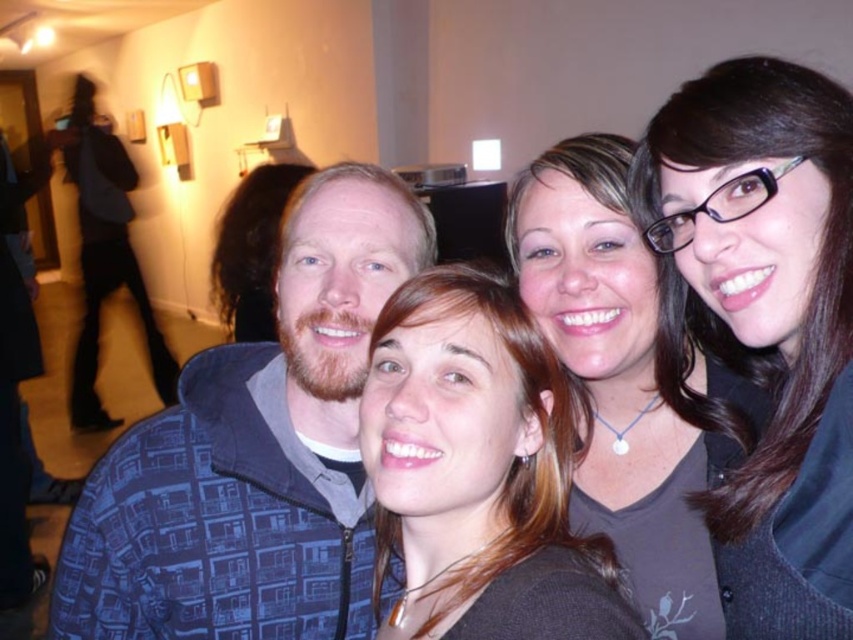
Who is positioned more to the left, matte gray sweater at upper right or blue patterned jacket at left?

blue patterned jacket at left is more to the left.

Does matte gray sweater at upper right lie behind blue patterned jacket at left?

No, matte gray sweater at upper right is closer to the viewer.

Does point (697, 554) lie in front of point (80, 140)?

Yes, it is in front of point (80, 140).

The image size is (853, 640). In order to click on matte gray sweater at upper right in this screenshot , I will do `click(618, 380)`.

Can you confirm if smooth brown hair at center is smaller than matte gray sweater at upper right?

Indeed, smooth brown hair at center has a smaller size compared to matte gray sweater at upper right.

Is point (430, 488) in front of point (631, 556)?

Yes, it is.

Identify the location of smooth brown hair at center. (477, 472).

Find the location of a particular element. The width and height of the screenshot is (853, 640). smooth brown hair at center is located at coordinates (477, 472).

Does blue printed jacket at center appear under black glossy hair at upper right?

Indeed, blue printed jacket at center is positioned under black glossy hair at upper right.

Locate an element on the screen. Image resolution: width=853 pixels, height=640 pixels. blue printed jacket at center is located at coordinates (254, 451).

This screenshot has height=640, width=853. I want to click on blue printed jacket at center, so click(254, 451).